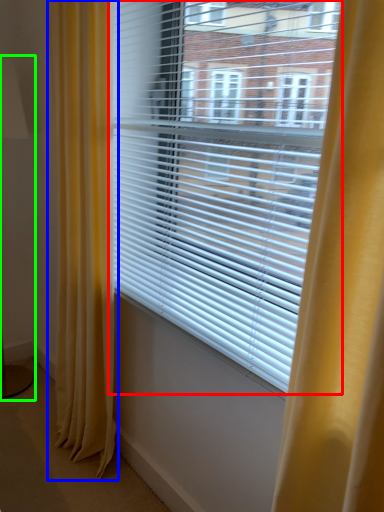
Question: Based on their relative distances, which object is farther from window blind (highlighted by a red box)? Choose from curtain (highlighted by a blue box) and table lamp (highlighted by a green box).

Choices:
 (A) curtain
 (B) table lamp

Answer: (B)